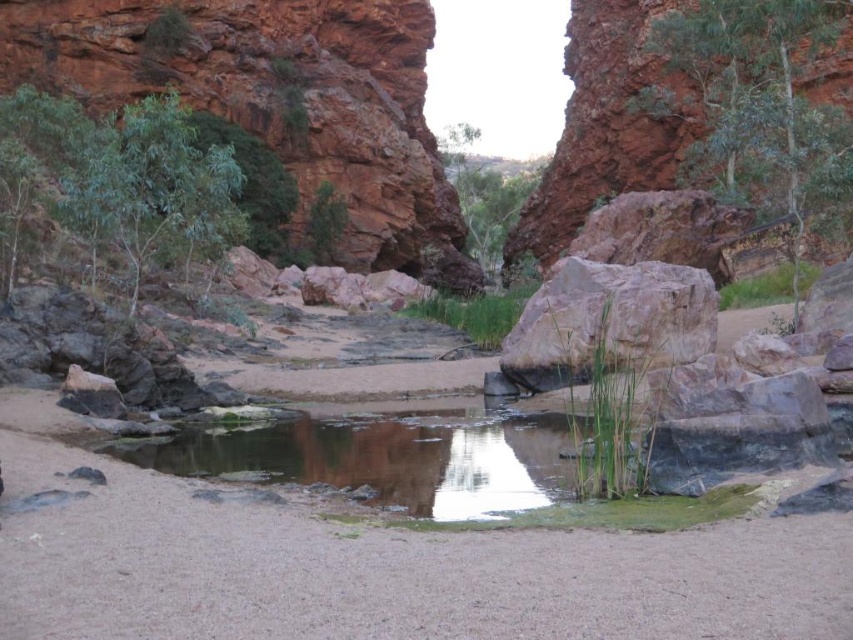
Question: Can you confirm if rustic sandstone cliff at upper left is positioned to the right of smooth beige rock at center?

Choices:
 (A) no
 (B) yes

Answer: (A)

Question: Which point appears closest to the camera in this image?

Choices:
 (A) (544, 324)
 (B) (102, 83)

Answer: (A)

Question: Is rustic sandstone cliff at upper left positioned in front of smooth beige rock at center?

Choices:
 (A) yes
 (B) no

Answer: (B)

Question: Does rustic sandstone cliff at upper left have a lesser width compared to smooth beige rock at center?

Choices:
 (A) yes
 (B) no

Answer: (B)

Question: Which of the following is the farthest from the observer?

Choices:
 (A) (126, 51)
 (B) (548, 380)

Answer: (A)